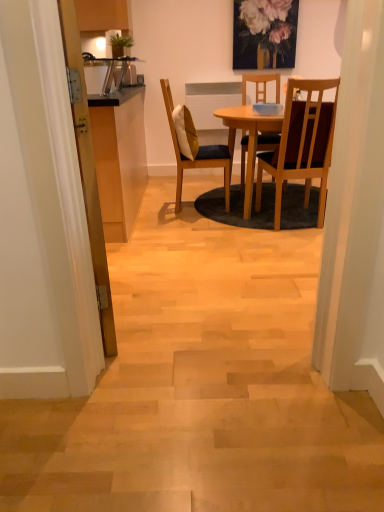
Question: Considering the relative sizes of wooden chair with cushion at center, positioned as the second chair in right-to-left order, and yellow fabric pillow at center in the image provided, is wooden chair with cushion at center, positioned as the second chair in right-to-left order, wider than yellow fabric pillow at center?

Choices:
 (A) no
 (B) yes

Answer: (B)

Question: From the image's perspective, is wooden chair with cushion at center, the first chair when ordered from left to right, over yellow fabric pillow at center?

Choices:
 (A) yes
 (B) no

Answer: (B)

Question: Is wooden chair with cushion at center, positioned as the second chair in right-to-left order, closer to camera compared to yellow fabric pillow at center?

Choices:
 (A) yes
 (B) no

Answer: (A)

Question: From the image's perspective, would you say wooden chair with cushion at center, the first chair when ordered from left to right, is shown under yellow fabric pillow at center?

Choices:
 (A) yes
 (B) no

Answer: (A)

Question: Does wooden chair with cushion at center, positioned as the second chair in right-to-left order, have a lesser width compared to yellow fabric pillow at center?

Choices:
 (A) no
 (B) yes

Answer: (A)

Question: Is wooden door at left wider or thinner than wooden chair with cushion at center, the first chair when ordered from left to right?

Choices:
 (A) thin
 (B) wide

Answer: (A)

Question: Is wooden door at left inside the boundaries of wooden chair with cushion at center, positioned as the second chair in right-to-left order, or outside?

Choices:
 (A) outside
 (B) inside

Answer: (A)

Question: In terms of size, does wooden door at left appear bigger or smaller than wooden chair with cushion at center, positioned as the second chair in right-to-left order?

Choices:
 (A) big
 (B) small

Answer: (B)

Question: Considering the positions of wooden door at left and wooden chair with cushion at center, positioned as the second chair in right-to-left order, in the image, is wooden door at left taller or shorter than wooden chair with cushion at center, positioned as the second chair in right-to-left order,?

Choices:
 (A) tall
 (B) short

Answer: (A)

Question: Visually, is yellow fabric pillow at center positioned to the left or to the right of brown wooden chair at center, which ranks as the first chair in right-to-left order?

Choices:
 (A) left
 (B) right

Answer: (A)

Question: In terms of height, does yellow fabric pillow at center look taller or shorter compared to brown wooden chair at center, marked as the second chair in a left-to-right arrangement?

Choices:
 (A) short
 (B) tall

Answer: (A)

Question: Based on their sizes in the image, would you say yellow fabric pillow at center is bigger or smaller than brown wooden chair at center, which ranks as the first chair in right-to-left order?

Choices:
 (A) big
 (B) small

Answer: (B)

Question: Considering their positions, is yellow fabric pillow at center located in front of or behind brown wooden chair at center, marked as the second chair in a left-to-right arrangement?

Choices:
 (A) behind
 (B) front

Answer: (A)

Question: Do you think wooden chair with cushion at center, positioned as the second chair in right-to-left order, is within yellow fabric pillow at center, or outside of it?

Choices:
 (A) outside
 (B) inside

Answer: (A)

Question: From their relative heights in the image, would you say wooden chair with cushion at center, positioned as the second chair in right-to-left order, is taller or shorter than yellow fabric pillow at center?

Choices:
 (A) short
 (B) tall

Answer: (B)